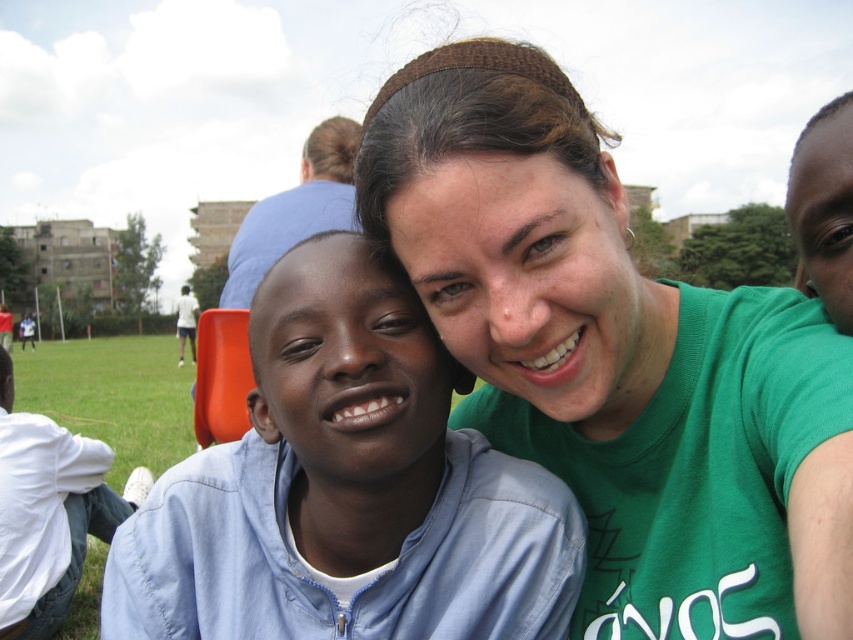
Is light blue fabric shirt at center below white cotton shirt at lower left?

Incorrect, light blue fabric shirt at center is not positioned below white cotton shirt at lower left.

Which is more to the right, light blue fabric shirt at center or white cotton shirt at lower left?

light blue fabric shirt at center is more to the right.

Who is more forward, (422, 428) or (39, 586)?

Point (422, 428)

This screenshot has height=640, width=853. I want to click on light blue fabric shirt at center, so click(x=346, y=490).

Which is below, green t-shirt at upper right or white cotton shirt at lower left?

Positioned lower is white cotton shirt at lower left.

Between green t-shirt at upper right and white cotton shirt at lower left, which one appears on the left side from the viewer's perspective?

From the viewer's perspective, white cotton shirt at lower left appears more on the left side.

Locate an element on the screen. green t-shirt at upper right is located at coordinates (616, 358).

Who is positioned more to the right, white cotton shirt at lower left or blue fabric shirt at center?

From the viewer's perspective, blue fabric shirt at center appears more on the right side.

Is point (9, 452) positioned behind point (338, 192)?

No, (9, 452) is closer to viewer.

Is point (47, 502) positioned before point (276, 236)?

Yes.

Find the location of a particular element. This screenshot has width=853, height=640. white cotton shirt at lower left is located at coordinates (50, 513).